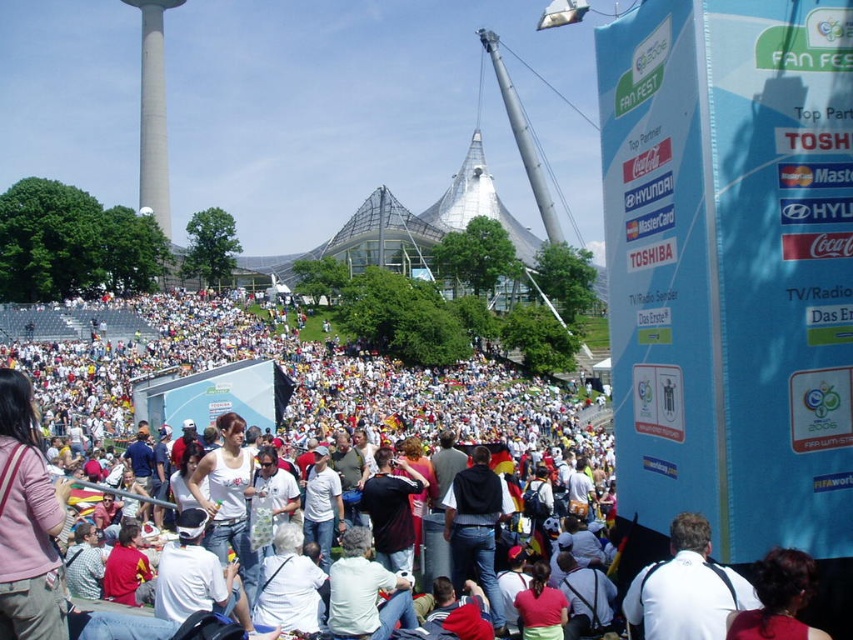
Question: Which of the following is the closest to the observer?

Choices:
 (A) tap(73, 401)
 (B) tap(759, 593)

Answer: (B)

Question: Does smooth concrete tower at upper left have a lesser width compared to dark red hair at center?

Choices:
 (A) yes
 (B) no

Answer: (B)

Question: Observing the image, what is the correct spatial positioning of white casual clothing at center in reference to white fabric shirt at center?

Choices:
 (A) left
 (B) right

Answer: (A)

Question: Can you confirm if white casual clothing at center is thinner than dark red hair at center?

Choices:
 (A) no
 (B) yes

Answer: (A)

Question: Which point is farther to the camera?

Choices:
 (A) (210, 396)
 (B) (770, 625)
 (C) (646, 630)
 (D) (173, 3)

Answer: (D)

Question: Which point is farther to the camera?

Choices:
 (A) smooth concrete tower at upper left
 (B) white fabric shirt at center
 (C) dark red hair at center
 (D) white casual clothing at center

Answer: (A)